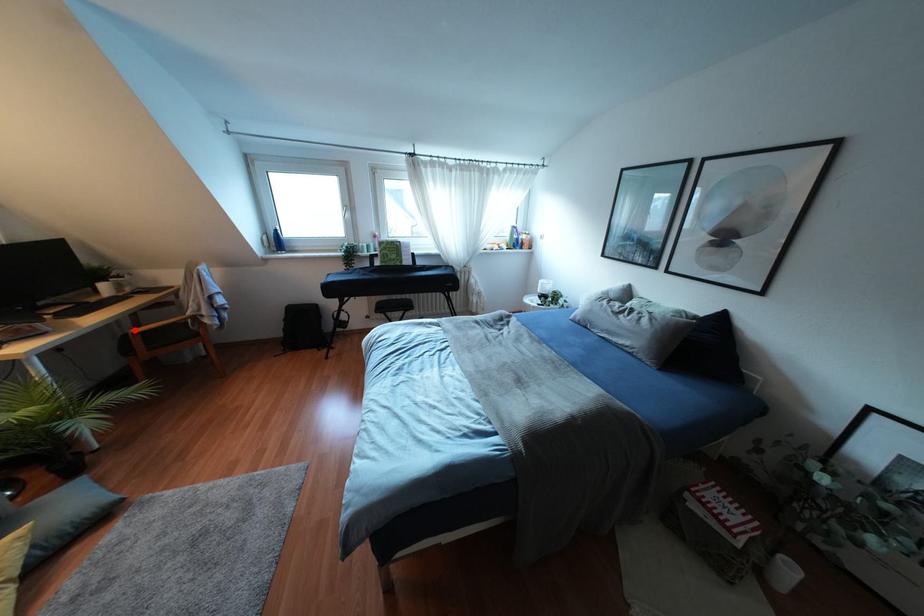
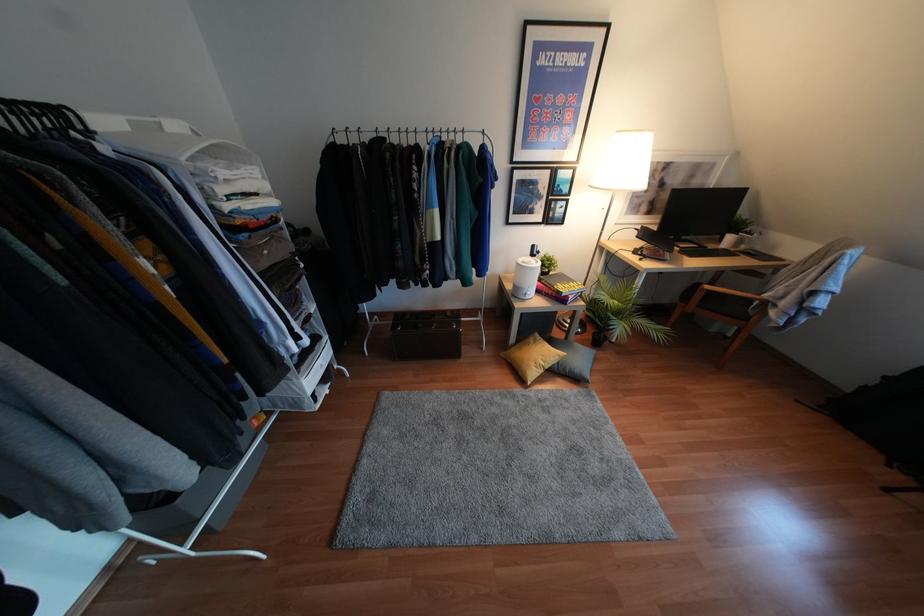
Where in the second image is the point corresponding to the highlighted location from the first image?

(707, 286)